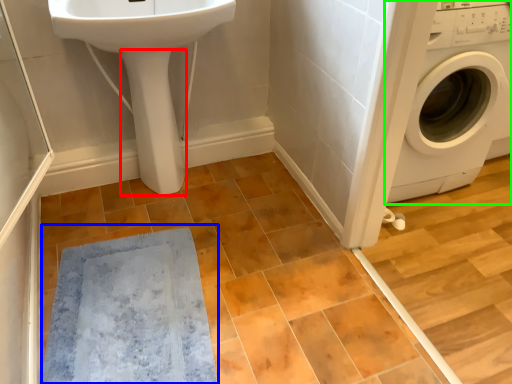
Question: Which object is positioned farthest from bidet (highlighted by a red box)? Select from bath mat (highlighted by a blue box) and washing machine (highlighted by a green box).

Choices:
 (A) bath mat
 (B) washing machine

Answer: (B)